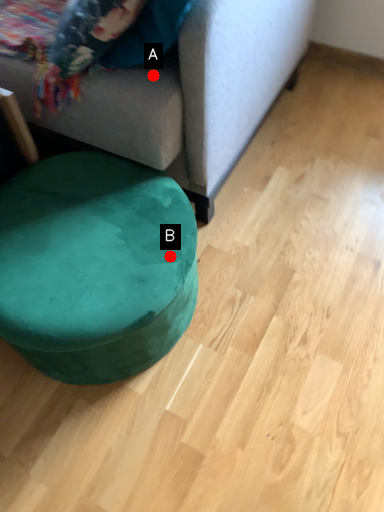
Question: Two points are circled on the image, labeled by A and B beside each circle. Among these points, which one is nearest to the camera?

Choices:
 (A) A is closer
 (B) B is closer

Answer: (B)